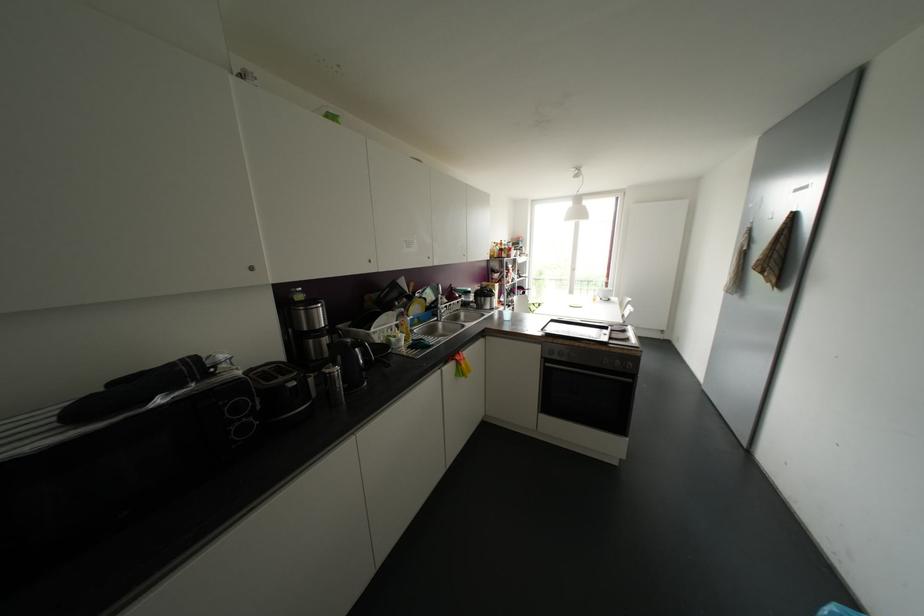
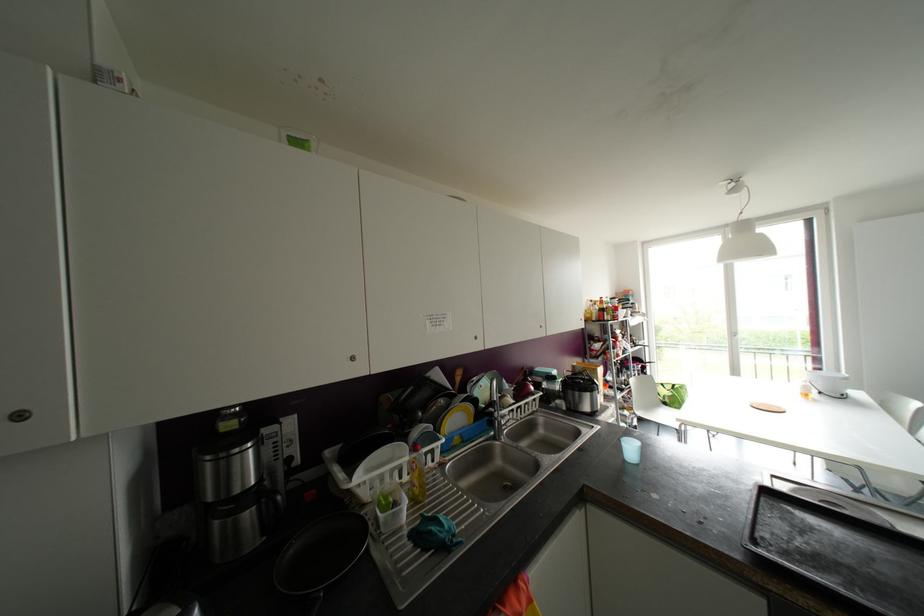
Locate, in the second image, the point that corresponds to the point at 400,314 in the first image.

(414, 448)